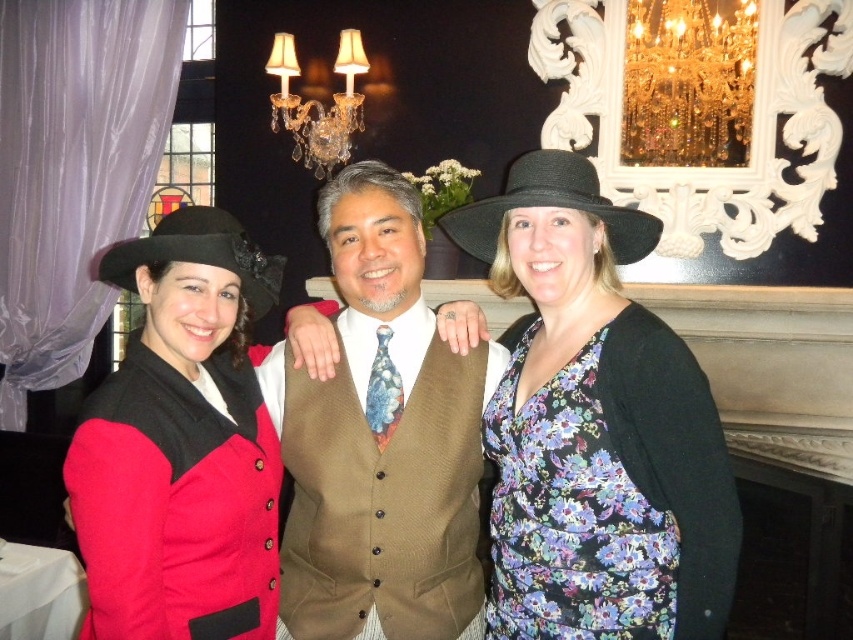
You are a photographer setting up for a group photo. You need to ensure that the matte black hat at left and the floral print fabric dress at center are both visible in the frame. Given their sizes, which object should you prioritize positioning closer to the camera to maintain clarity?

The matte black hat at left is larger in size compared to the floral print fabric dress at center. To ensure both are visible, position the matte black hat at left closer to the camera since its larger size may require more focus to capture details clearly.

You are a photographer at the event and want to capture a clear shot of the black felt hat at center without the crystal glass chandelier at upper center blocking it. Is this possible given their positions?

The black felt hat at center is in front of the crystal glass chandelier at upper center, so it will block the view of the chandelier. To capture a clear shot of the hat without the chandelier, you can adjust your angle or position to ensure the hat is framed in a way that the chandelier is not in the same line of sight.

You are standing in front of the image and want to determine which of the two points, point (x=548, y=157) or point (x=352, y=61), is nearer to you. Based on the scene, which point is closer?

Point (x=548, y=157) is closer to the viewer than point (x=352, y=61).